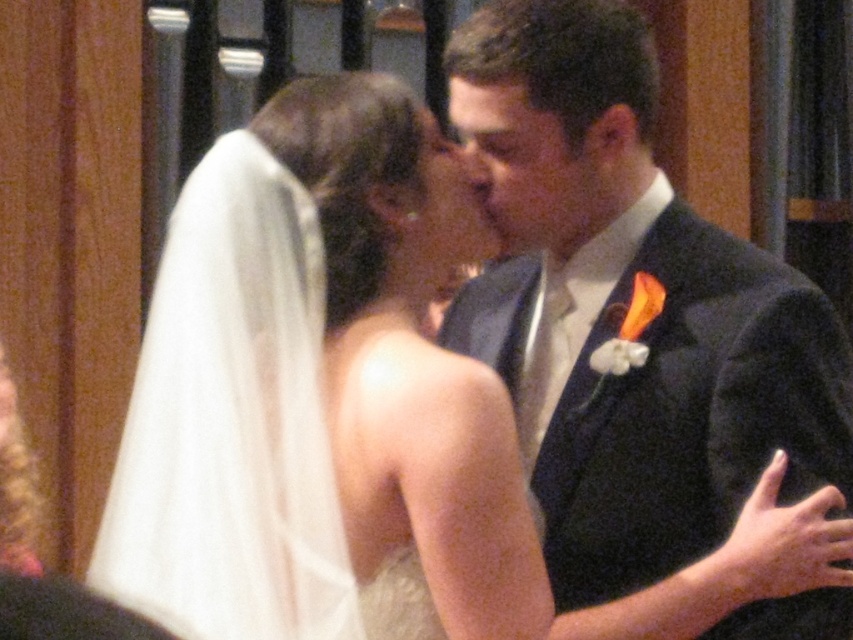
Which is behind, point (527, 342) or point (465, 132)?

The point (527, 342) is more distant.

Can you confirm if matte black suit at center is positioned above matte black forehead at center?

No, matte black suit at center is not above matte black forehead at center.

Between point (630, 81) and point (463, 108), which one is positioned in front?

Point (630, 81)

Identify the location of matte black suit at center. (624, 316).